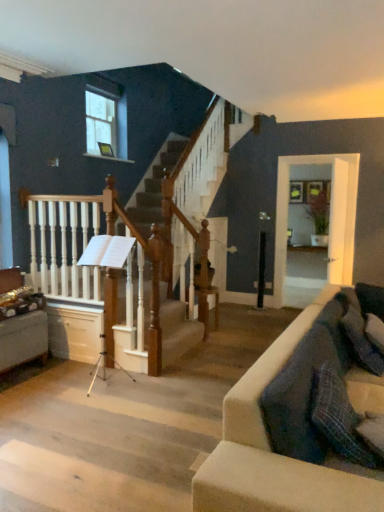
Question: Is white wood railing at left taller or shorter than clear glass window at upper left?

Choices:
 (A) short
 (B) tall

Answer: (B)

Question: Considering their positions, is white wood railing at left located in front of or behind clear glass window at upper left?

Choices:
 (A) behind
 (B) front

Answer: (B)

Question: Would you say white wood railing at left is to the left or to the right of clear glass window at upper left in the picture?

Choices:
 (A) right
 (B) left

Answer: (A)

Question: Is clear glass window at upper left spatially inside white wood railing at left, or outside of it?

Choices:
 (A) inside
 (B) outside

Answer: (B)

Question: Considering the positions of clear glass window at upper left and white wood railing at left in the image, is clear glass window at upper left wider or thinner than white wood railing at left?

Choices:
 (A) thin
 (B) wide

Answer: (A)

Question: From their relative heights in the image, would you say clear glass window at upper left is taller or shorter than white wood railing at left?

Choices:
 (A) short
 (B) tall

Answer: (A)

Question: Considering the positions of point (109, 134) and point (196, 323), is point (109, 134) closer or farther from the camera than point (196, 323)?

Choices:
 (A) farther
 (B) closer

Answer: (A)